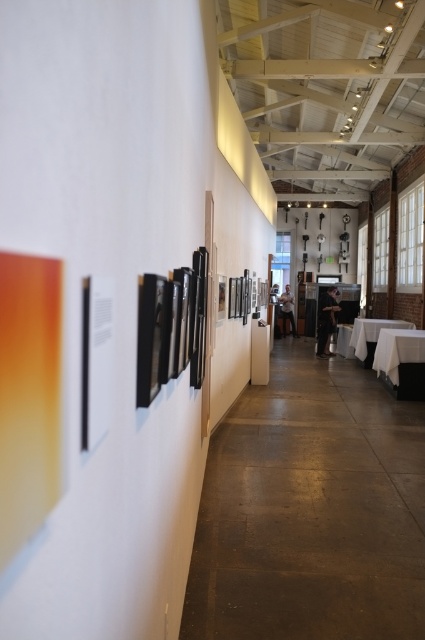
You are a photographer who wants to take a picture of the white cloth table at center from a distance of 35 feet. Based on the scene description, will you be able to capture the entire table in your shot?

The white cloth table at center and camera are 35.90 feet apart from each other. Since the desired distance is 35 feet, which is slightly closer than the actual distance of 35.90 feet, you can still capture the entire table in your shot as the difference is minimal.